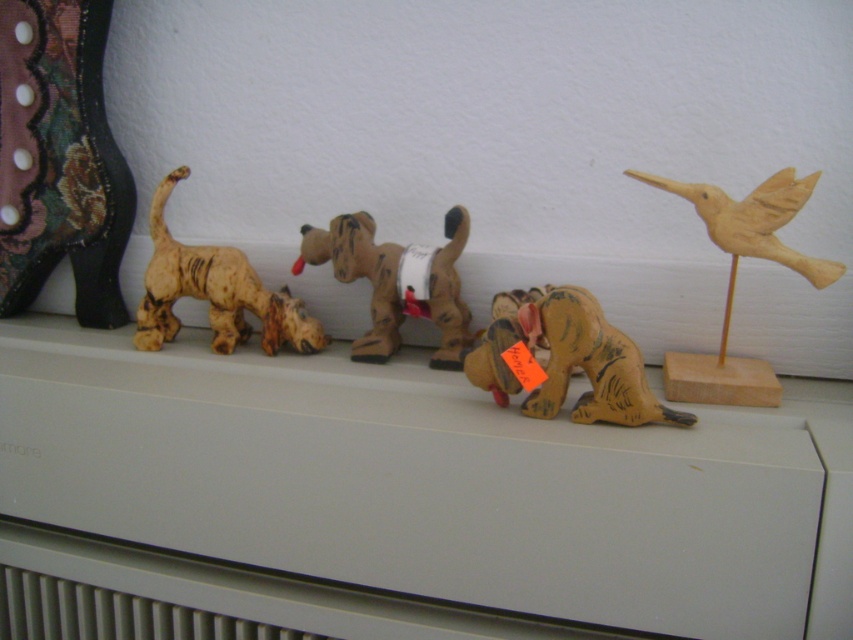
You are looking at the collection of wooden figurines on the radiator. There are four dogs and a wooden bird at right. Which figurine is located at the coordinate point 0.436, 0.863?

The wooden bird at right is located at point [735,278].

You are standing in front of the radiator with the figurines. Where exactly is the matte brown dog at center located in terms of coordinates?

The matte brown dog at center is located at coordinates point [564,360].